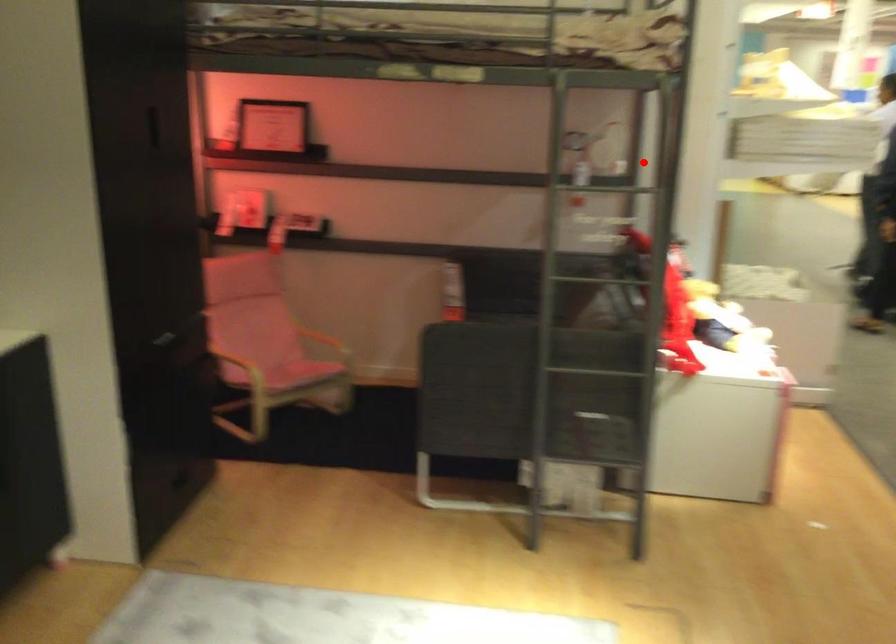
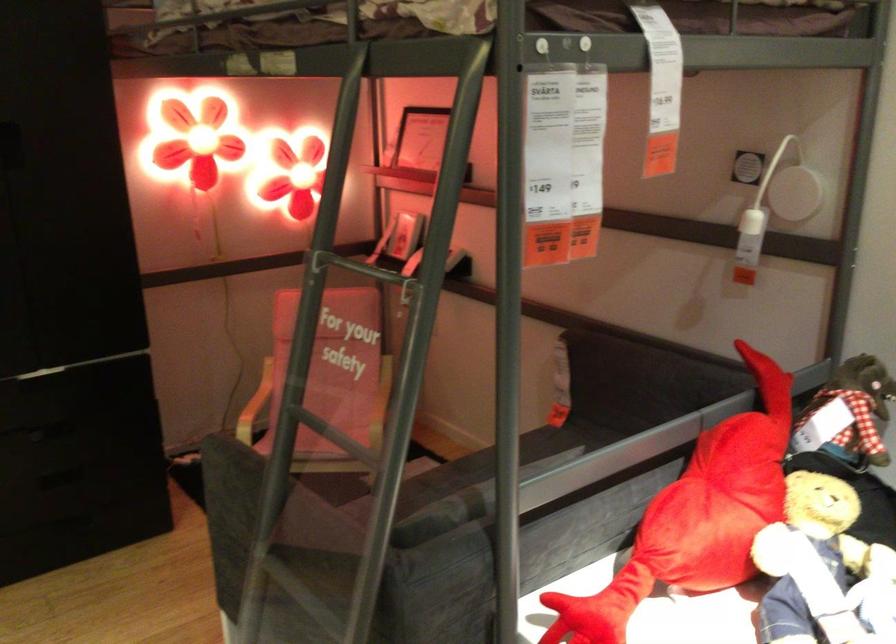
In the second image, find the point that corresponds to the highlighted location in the first image.

(751, 236)